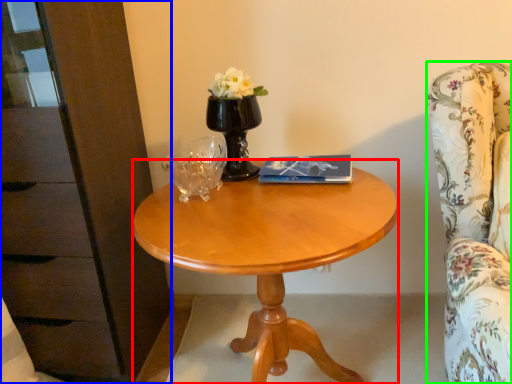
Question: Which is farther away from desk (highlighted by a red box)? dresser (highlighted by a blue box) or chair (highlighted by a green box)?

Choices:
 (A) dresser
 (B) chair

Answer: (A)